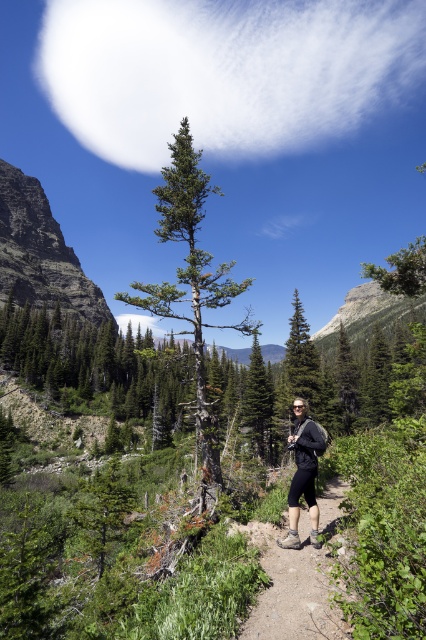
You are standing at the starting point of the trail and want to reach the green matte tree at center. According to the coordinates provided, in which direction should you head from your current position to reach the tree?

The green matte tree at center is located at coordinates point (258, 401), so you should head towards the direction of those coordinates to reach it.

You are navigating a hiking trail and want to reach a specific destination. You have two reference points marked on your map as point [354,106] and point [314,499]. Which point should you head towards first if you want to follow the trail in the correct order?

You should head towards point [314,499] first because point [354,106] is behind it, meaning the trail progresses from point [314,499] to point [354,106].

You are standing at the base of the lone, tall evergreen tree in the foreground of the mountain hike scene. You notice a point marked at coordinates (224, 72). What object is located at that point?

The point at coordinates (224, 72) corresponds to a white fluffy cloud at upper center.